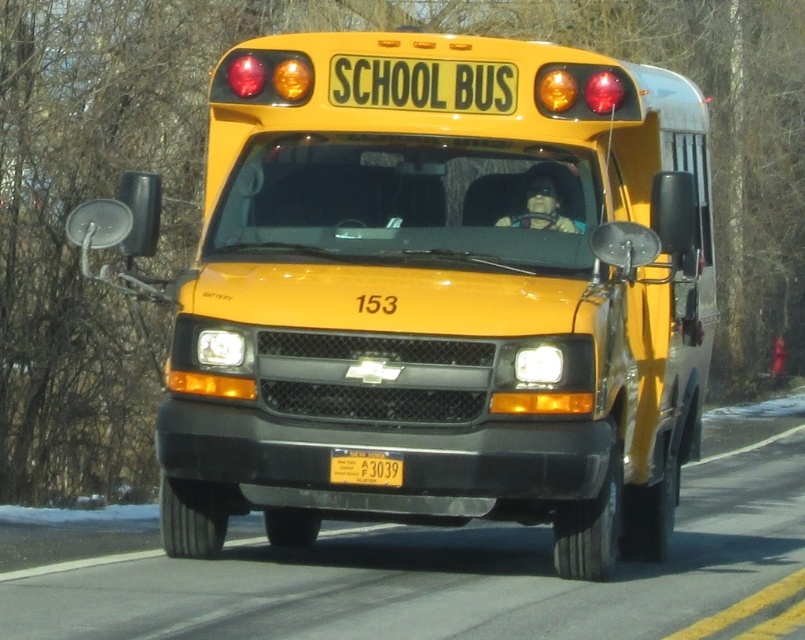
Which of these two, yellow matte school bus at center or yellow matte license plate at center, stands shorter?

Standing shorter between the two is yellow matte license plate at center.

Which is behind, point (531, 204) or point (351, 472)?

Point (531, 204)

Find the location of `yellow matte school bus at center`. yellow matte school bus at center is located at coordinates (432, 291).